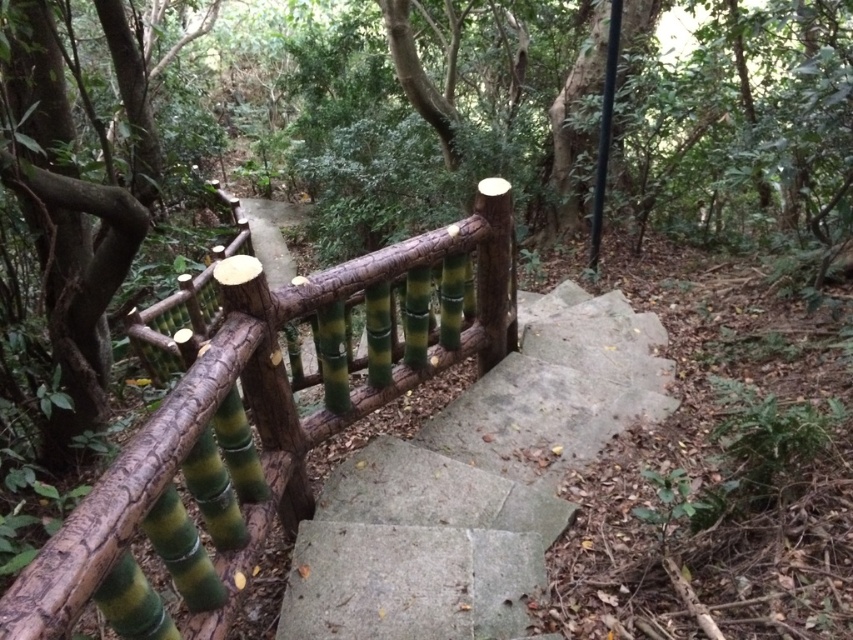
From the picture: Can you confirm if green bamboo railing at left is bigger than smooth concrete stairs at center?

Yes.

Which of these two, green bamboo railing at left or smooth concrete stairs at center, stands taller?

green bamboo railing at left is taller.

Who is more distant from viewer, (460, 344) or (486, 449)?

Point (460, 344)

Find the location of `green bamboo railing at left`. green bamboo railing at left is located at coordinates (264, 422).